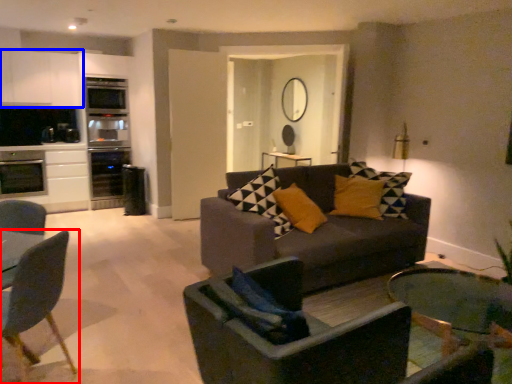
Question: Which object is further to the camera taking this photo, chair (highlighted by a red box) or cabinetry (highlighted by a blue box)?

Choices:
 (A) chair
 (B) cabinetry

Answer: (B)